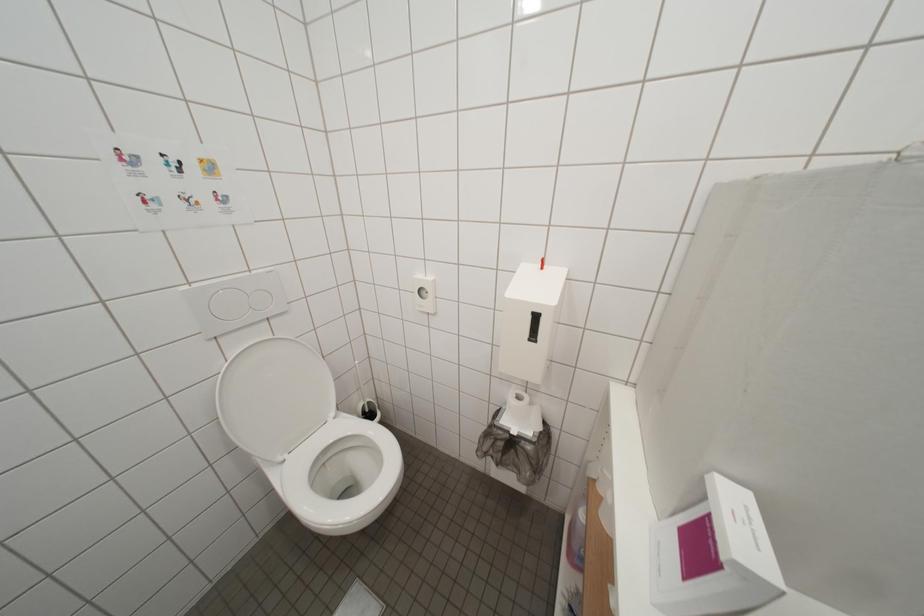
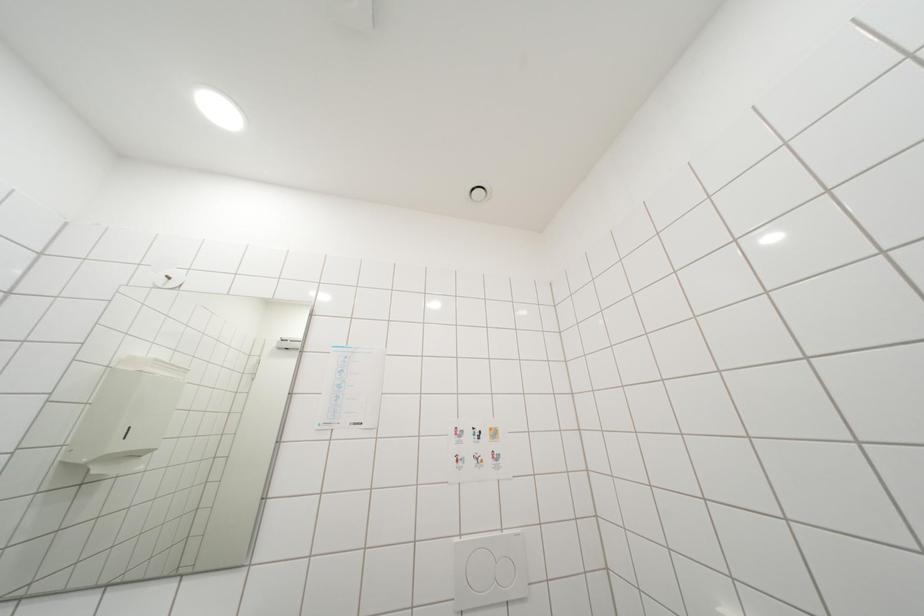
First-person continuous shooting, in which direction is the camera rotating?

The camera's rotation is toward left-up.